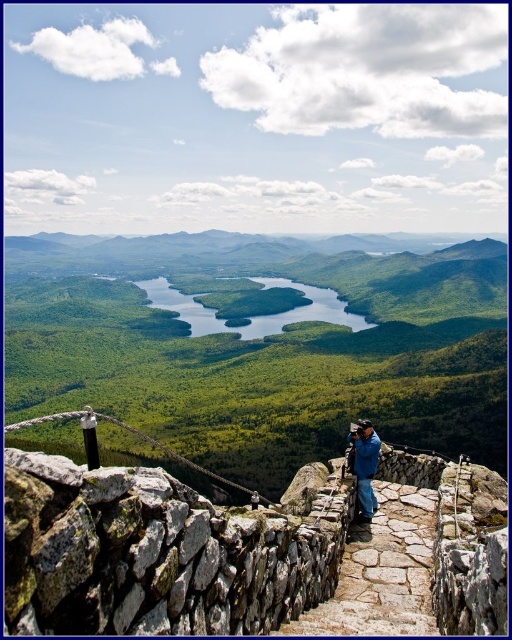
Is green grassy valley at center taller than gray rough stone at center?

Yes.

Who is positioned more to the left, green grassy valley at center or gray rough stone at center?

gray rough stone at center is more to the left.

Where is `green grassy valley at center`? This screenshot has width=512, height=640. green grassy valley at center is located at coordinates (263, 346).

At what (x,y) coordinates should I click in order to perform the action: click on green grassy valley at center. Please return your answer as a coordinate pair (x, y). Looking at the image, I should click on (263, 346).

Does green grassy valley at center have a greater height compared to blue glossy water at center?

Yes.

Can you confirm if green grassy valley at center is bigger than blue glossy water at center?

Yes.

Is point (109, 429) closer to camera compared to point (159, 301)?

Yes.

Find the location of `green grassy valley at center`. green grassy valley at center is located at coordinates (263, 346).

Who is higher up, green grassy valley at center or blue fabric jacket at lower center?

green grassy valley at center

Does point (131, 440) come behind point (356, 461)?

Yes, point (131, 440) is behind point (356, 461).

I want to click on green grassy valley at center, so click(263, 346).